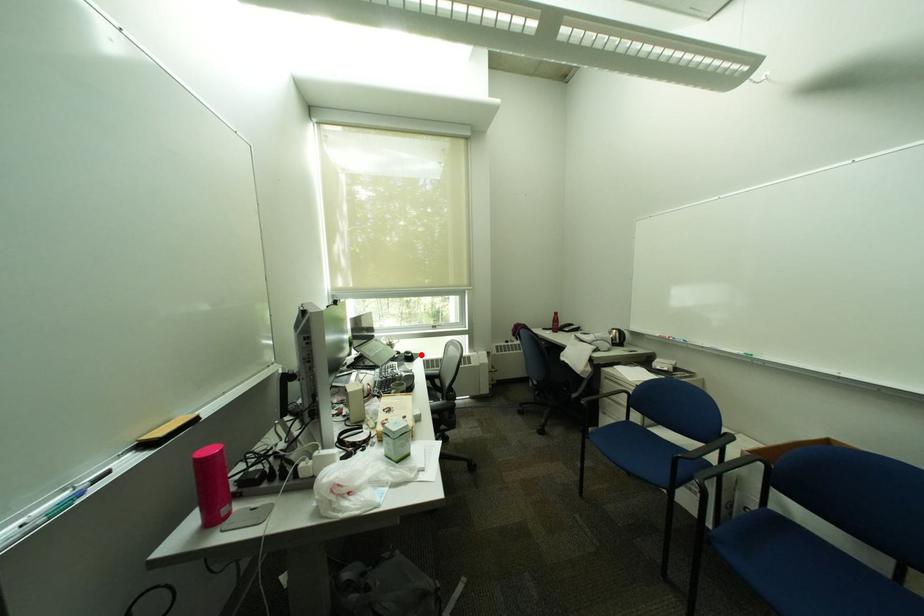
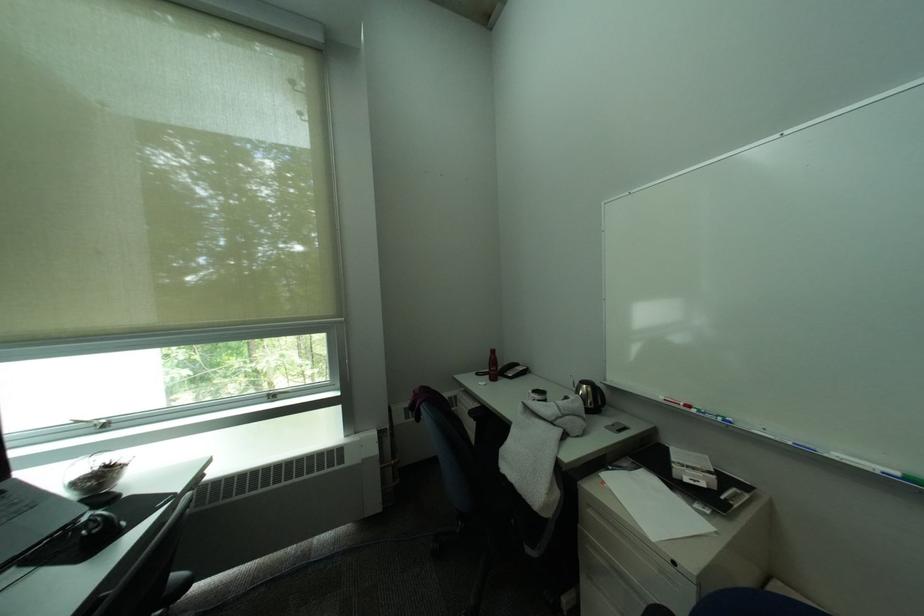
The point at the highlighted location is marked in the first image. Where is the corresponding point in the second image?

(106, 528)